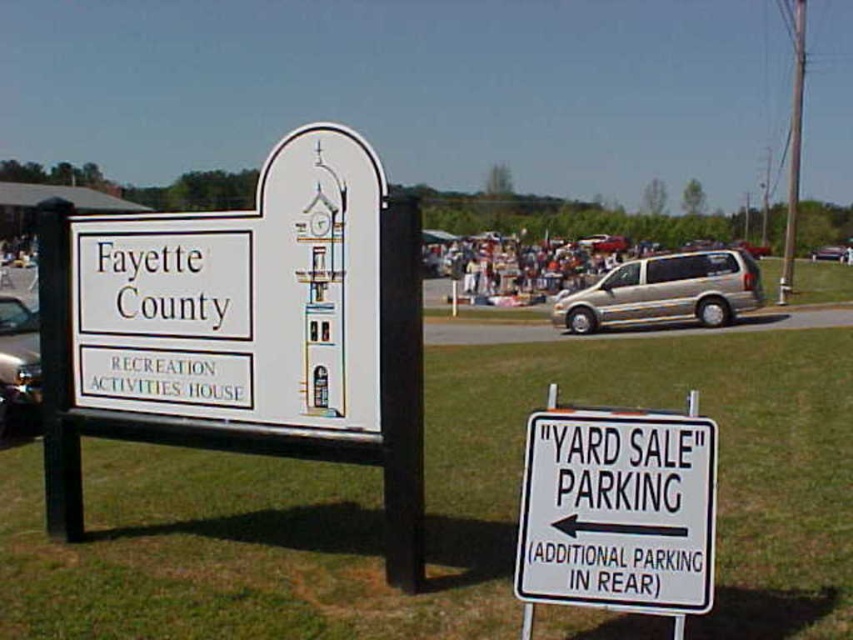
Question: Does white plastic sign at center appear under metallic silver van at center?

Choices:
 (A) yes
 (B) no

Answer: (A)

Question: Is the position of green grass at lower center less distant than that of white plastic sign at center?

Choices:
 (A) yes
 (B) no

Answer: (A)

Question: Which of the following is the farthest from the observer?

Choices:
 (A) gold metallic minivan at right
 (B) green grass at lower center

Answer: (A)

Question: Does white plastic sign at lower center appear under metallic silver van at center?

Choices:
 (A) no
 (B) yes

Answer: (B)

Question: Among these points, which one is nearest to the camera?

Choices:
 (A) (799, 408)
 (B) (817, 253)
 (C) (350, 189)

Answer: (C)

Question: Which of these objects is positioned farthest from the gold metallic minivan at right?

Choices:
 (A) green grass at lower center
 (B) white plastic sign at center

Answer: (B)